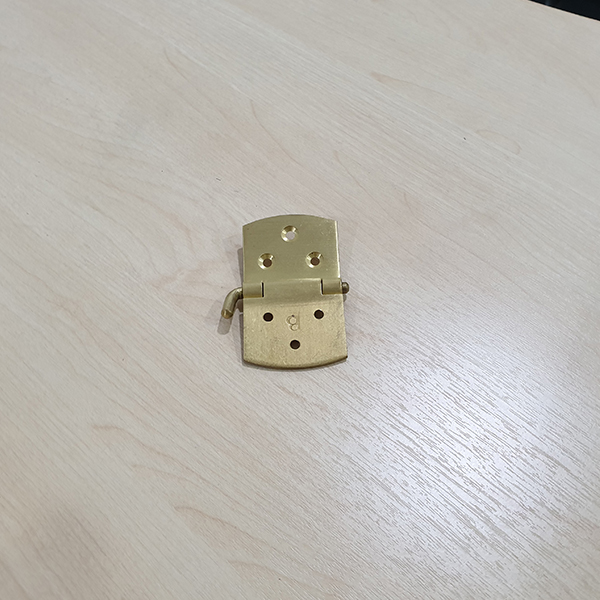
Locate an element on the screen. The width and height of the screenshot is (600, 600). hinge is located at coordinates (326, 300).